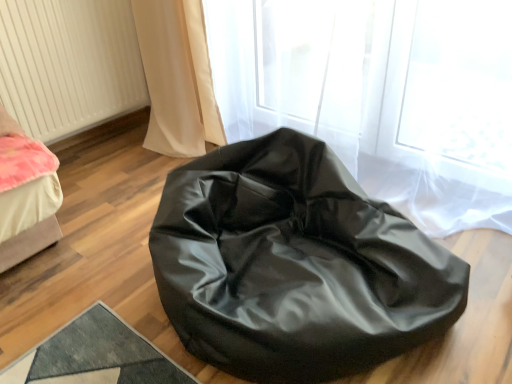
Question: Is white textured radiator at left not inside glossy black bean bag at center?

Choices:
 (A) yes
 (B) no

Answer: (A)

Question: From a real-world perspective, is white textured radiator at left positioned under glossy black bean bag at center based on gravity?

Choices:
 (A) yes
 (B) no

Answer: (B)

Question: Are white textured radiator at left and glossy black bean bag at center far apart?

Choices:
 (A) yes
 (B) no

Answer: (A)

Question: Does white textured radiator at left have a greater height compared to glossy black bean bag at center?

Choices:
 (A) no
 (B) yes

Answer: (B)

Question: Does white textured radiator at left have a greater width compared to glossy black bean bag at center?

Choices:
 (A) yes
 (B) no

Answer: (B)

Question: Can you confirm if white textured radiator at left is thinner than glossy black bean bag at center?

Choices:
 (A) yes
 (B) no

Answer: (A)

Question: Is glossy black bean bag at center at the right side of white textured radiator at left?

Choices:
 (A) yes
 (B) no

Answer: (A)

Question: Is glossy black bean bag at center shorter than white textured radiator at left?

Choices:
 (A) yes
 (B) no

Answer: (A)

Question: Is white textured radiator at left surrounded by glossy black bean bag at center?

Choices:
 (A) yes
 (B) no

Answer: (B)

Question: Considering the relative sizes of glossy black bean bag at center and white textured radiator at left in the image provided, is glossy black bean bag at center bigger than white textured radiator at left?

Choices:
 (A) no
 (B) yes

Answer: (B)

Question: Is glossy black bean bag at center next to white textured radiator at left?

Choices:
 (A) yes
 (B) no

Answer: (B)

Question: Is glossy black bean bag at center positioned far away from white textured radiator at left?

Choices:
 (A) yes
 (B) no

Answer: (A)

Question: Is white textured radiator at left spatially inside glossy black bean bag at center, or outside of it?

Choices:
 (A) inside
 (B) outside

Answer: (B)